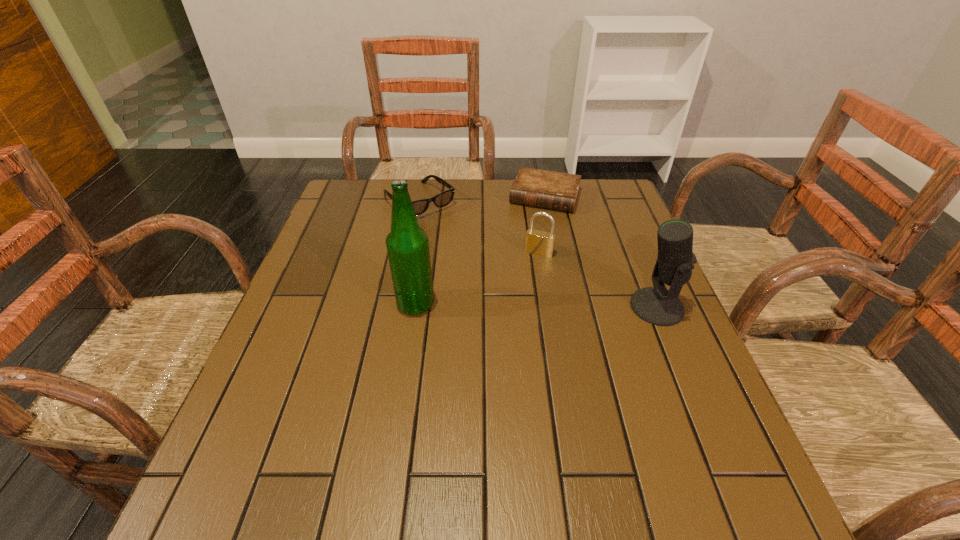
Identify the location of beer bottle. This screenshot has width=960, height=540. (407, 245).

This screenshot has height=540, width=960. I want to click on microphone, so click(x=656, y=305).

Locate an element on the screen. The height and width of the screenshot is (540, 960). the second tallest object is located at coordinates (656, 305).

Find the location of a particular element. The image size is (960, 540). the shortest object is located at coordinates (546, 189).

This screenshot has width=960, height=540. What are the coordinates of `the fourth tallest object` in the screenshot? It's located at (442, 199).

Image resolution: width=960 pixels, height=540 pixels. In order to click on padlock in this screenshot , I will do `click(540, 243)`.

The width and height of the screenshot is (960, 540). I want to click on the third farthest object, so click(x=540, y=243).

At what (x,y) coordinates should I click in order to perform the action: click on free region located 0.100m on the label of the beer bottle. Please return your answer as a coordinate pair (x, y). Looking at the image, I should click on (353, 305).

Find the location of a particular element. The image size is (960, 540). free space located 0.160m on the label of the beer bottle is located at coordinates (327, 305).

At what (x,y) coordinates should I click in order to perform the action: click on free location located on the front of the fourth shortest object. Please return your answer as a coordinate pair (x, y). The width and height of the screenshot is (960, 540). Looking at the image, I should click on (672, 344).